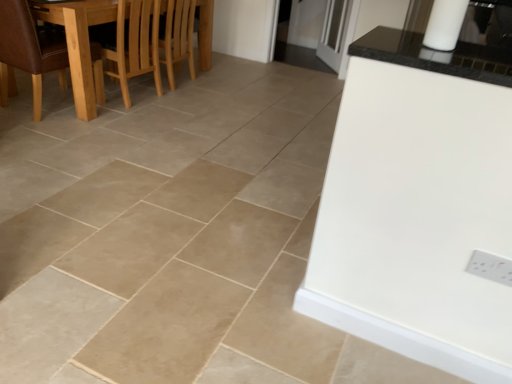
Question: Is light brown wooden chair at upper left thinner than white plastic electric outlet at lower right?

Choices:
 (A) no
 (B) yes

Answer: (A)

Question: Can you confirm if light brown wooden chair at upper left is wider than white plastic electric outlet at lower right?

Choices:
 (A) no
 (B) yes

Answer: (B)

Question: Is light brown wooden chair at upper left closer to the viewer compared to white plastic electric outlet at lower right?

Choices:
 (A) yes
 (B) no

Answer: (B)

Question: Considering the relative positions of light brown wooden chair at upper left and white plastic electric outlet at lower right in the image provided, is light brown wooden chair at upper left to the right of white plastic electric outlet at lower right from the viewer's perspective?

Choices:
 (A) yes
 (B) no

Answer: (B)

Question: Does light brown wooden chair at upper left appear on the left side of white plastic electric outlet at lower right?

Choices:
 (A) no
 (B) yes

Answer: (B)

Question: In terms of height, does transparent glass door at upper center look taller or shorter compared to brown leather chair at left?

Choices:
 (A) tall
 (B) short

Answer: (A)

Question: From a real-world perspective, is transparent glass door at upper center above or below brown leather chair at left?

Choices:
 (A) above
 (B) below

Answer: (B)

Question: Considering the positions of transparent glass door at upper center and brown leather chair at left in the image, is transparent glass door at upper center wider or thinner than brown leather chair at left?

Choices:
 (A) thin
 (B) wide

Answer: (A)

Question: Looking at the image, does transparent glass door at upper center seem bigger or smaller compared to brown leather chair at left?

Choices:
 (A) small
 (B) big

Answer: (A)

Question: Based on their positions, is transparent glass door at upper center located to the left or right of wooden dining table at left?

Choices:
 (A) left
 (B) right

Answer: (B)

Question: In terms of width, does transparent glass door at upper center look wider or thinner when compared to wooden dining table at left?

Choices:
 (A) thin
 (B) wide

Answer: (A)

Question: In the image, is transparent glass door at upper center positioned in front of or behind wooden dining table at left?

Choices:
 (A) front
 (B) behind

Answer: (B)

Question: From a real-world perspective, relative to wooden dining table at left, is transparent glass door at upper center vertically above or below?

Choices:
 (A) below
 (B) above

Answer: (A)

Question: Is light brown wooden chair at upper left situated inside transparent glass door at upper center or outside?

Choices:
 (A) inside
 (B) outside

Answer: (B)

Question: Considering their positions, is light brown wooden chair at upper left located in front of or behind transparent glass door at upper center?

Choices:
 (A) front
 (B) behind

Answer: (A)